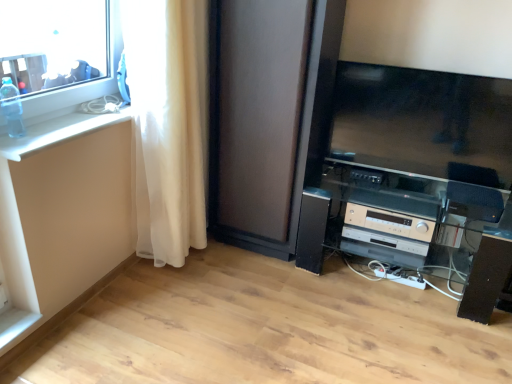
Question: From the image's perspective, is transparent plastic bottle at upper left above or below satin black entertainment center at lower right?

Choices:
 (A) below
 (B) above

Answer: (B)

Question: In terms of size, does transparent plastic bottle at upper left appear bigger or smaller than satin black entertainment center at lower right?

Choices:
 (A) small
 (B) big

Answer: (A)

Question: Which is farther from the matte black screen door at center?

Choices:
 (A) white glossy counter top at left
 (B) transparent plastic bottle at upper left
 (C) transparent glass window at upper left
 (D) white sheer curtain at left
 (E) beige plastic stereo at lower right

Answer: (B)

Question: Which object is positioned closest to the transparent plastic bottle at upper left?

Choices:
 (A) transparent glass window at upper left
 (B) white glossy counter top at left
 (C) beige plastic stereo at lower right
 (D) white sheer curtain at left
 (E) matte black screen door at center

Answer: (B)